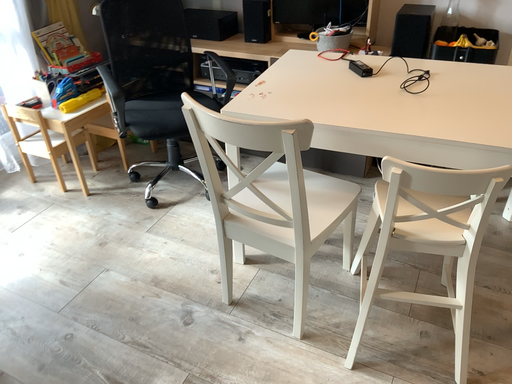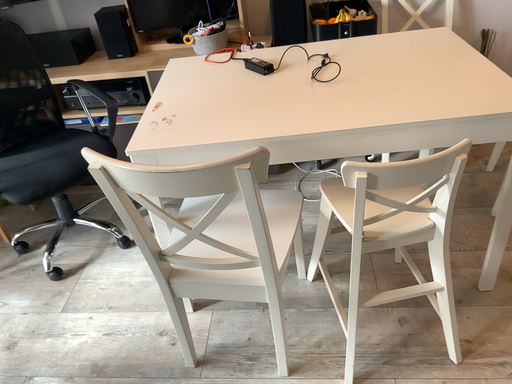
Question: Which way did the camera rotate in the video?

Choices:
 (A) rotated left
 (B) rotated right

Answer: (B)